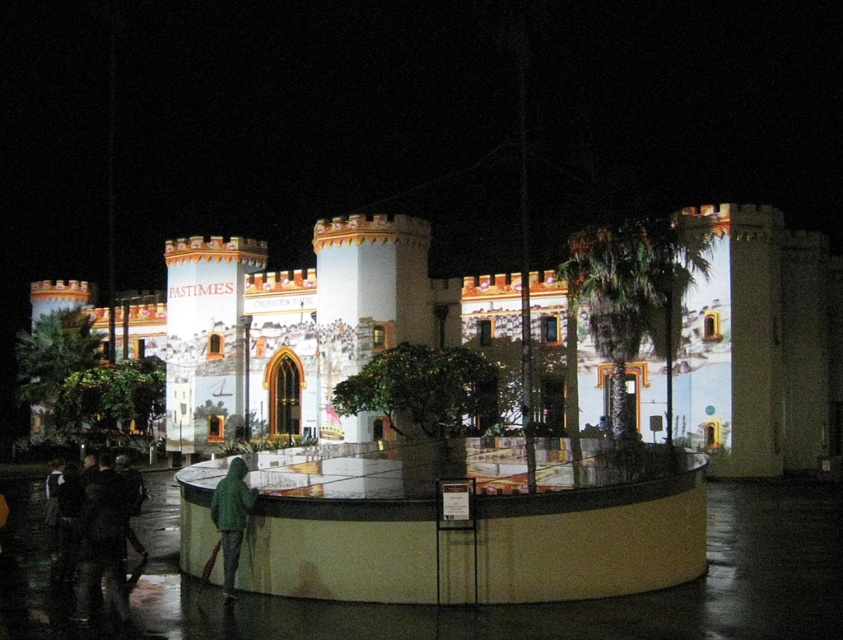
You are a guest at an event and want to take a photo of the matte white castle at center and the green matte jacket at lower left. Which object should you focus on first to ensure both are in the frame?

The matte white castle at center is taller than the green matte jacket at lower left, so you should focus on the matte white castle at center first to ensure both are in the frame.

You are standing on the circular platform in front of the matte white castle at center and the green matte jacket at lower left. Which object is located to your right?

The green matte jacket at lower left is located to your right because the matte white castle at center is positioned on the left side of it.